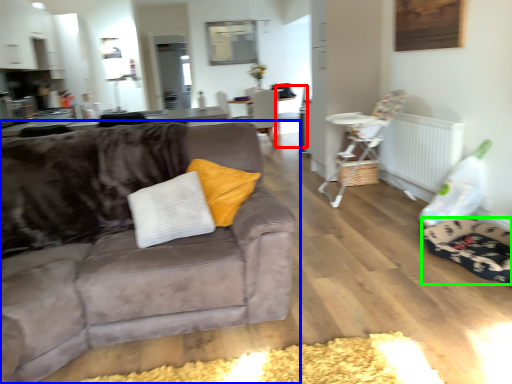
Question: Which object is positioned closest to armchair (highlighted by a red box)? Select from studio couch (highlighted by a blue box) and dog bed (highlighted by a green box).

Choices:
 (A) studio couch
 (B) dog bed

Answer: (B)